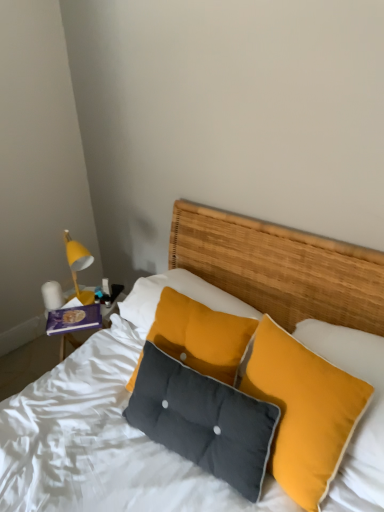
The width and height of the screenshot is (384, 512). What do you see at coordinates (78, 265) in the screenshot?
I see `yellow matte lampshade at left` at bounding box center [78, 265].

Image resolution: width=384 pixels, height=512 pixels. In order to click on textured yellow pillow at center, which ranks as the 2th pillow in left-to-right order in this screenshot , I will do `click(304, 411)`.

What do you see at coordinates (100, 443) in the screenshot? This screenshot has height=512, width=384. I see `textured woven headboard at center` at bounding box center [100, 443].

Find the location of a particular element. This screenshot has height=512, width=384. white glossy lamp at left is located at coordinates (52, 295).

The width and height of the screenshot is (384, 512). Find the location of `yellow matte lampshade at left`. yellow matte lampshade at left is located at coordinates (78, 265).

Which object is closer to the camera taking this photo, white glossy lamp at left or dark gray fabric pillow at center, the second pillow when ordered from right to left?

dark gray fabric pillow at center, the second pillow when ordered from right to left.

I want to click on lamp above the dark gray fabric pillow at center, the second pillow when ordered from right to left (from the image's perspective), so click(x=52, y=295).

Is white glossy lamp at left not near dark gray fabric pillow at center, positioned as the first pillow in left-to-right order?

No, white glossy lamp at left is not far away from dark gray fabric pillow at center, positioned as the first pillow in left-to-right order.

From the image's perspective, does white glossy lamp at left appear higher than dark gray fabric pillow at center, positioned as the first pillow in left-to-right order?

Correct, white glossy lamp at left appears higher than dark gray fabric pillow at center, positioned as the first pillow in left-to-right order, in the image.

From a real-world perspective, is white glossy lamp at left physically below yellow matte lampshade at left?

Correct, in the physical world, white glossy lamp at left is lower than yellow matte lampshade at left.

Does white glossy lamp at left appear on the left side of yellow matte lampshade at left?

Indeed, white glossy lamp at left is positioned on the left side of yellow matte lampshade at left.

Looking at this image, is white glossy lamp at left smaller than yellow matte lampshade at left?

Yes.

Does point (43, 465) lie in front of point (48, 302)?

Yes, point (43, 465) is in front of point (48, 302).

Is textured woven headboard at center positioned with its back to white glossy lamp at left?

No, white glossy lamp at left is not at the back of textured woven headboard at center.

Considering the sizes of objects textured woven headboard at center and white glossy lamp at left in the image provided, who is taller, textured woven headboard at center or white glossy lamp at left?

Standing taller between the two is textured woven headboard at center.

Consider the image. Is textured yellow pillow at center, which ranks as the 2th pillow in left-to-right order, far from dark gray fabric pillow at center, the second pillow when ordered from right to left?

textured yellow pillow at center, which ranks as the 2th pillow in left-to-right order, is near dark gray fabric pillow at center, the second pillow when ordered from right to left, not far away.

Is textured yellow pillow at center, which ranks as the 2th pillow in left-to-right order, wider or thinner than dark gray fabric pillow at center, positioned as the first pillow in left-to-right order?

Considering their sizes, textured yellow pillow at center, which ranks as the 2th pillow in left-to-right order, looks broader than dark gray fabric pillow at center, positioned as the first pillow in left-to-right order.

Between textured yellow pillow at center, which ranks as the 2th pillow in left-to-right order, and dark gray fabric pillow at center, positioned as the first pillow in left-to-right order, which one has less height?

With less height is dark gray fabric pillow at center, positioned as the first pillow in left-to-right order.

Which object is positioned more to the right, textured yellow pillow at center, arranged as the first pillow when viewed from the right, or dark gray fabric pillow at center, positioned as the first pillow in left-to-right order?

textured yellow pillow at center, arranged as the first pillow when viewed from the right.

Considering the sizes of objects white glossy lamp at left and textured woven headboard at center in the image provided, who is wider, white glossy lamp at left or textured woven headboard at center?

textured woven headboard at center is wider.

Considering the sizes of objects white glossy lamp at left and textured woven headboard at center in the image provided, who is shorter, white glossy lamp at left or textured woven headboard at center?

With less height is white glossy lamp at left.

What's the angular difference between white glossy lamp at left and textured woven headboard at center's facing directions?

49.6 degrees separate the facing orientations of white glossy lamp at left and textured woven headboard at center.

Identify the location of lamp behind the textured woven headboard at center. The width and height of the screenshot is (384, 512). (52, 295).

Is yellow matte lampshade at left to the right of textured yellow pillow at center, arranged as the first pillow when viewed from the right, from the viewer's perspective?

No.

Does yellow matte lampshade at left come behind textured yellow pillow at center, which ranks as the 2th pillow in left-to-right order?

Yes, it is.

Is yellow matte lampshade at left turned away from textured yellow pillow at center, which ranks as the 2th pillow in left-to-right order?

No, yellow matte lampshade at left's orientation is not away from textured yellow pillow at center, which ranks as the 2th pillow in left-to-right order.

Between point (92, 298) and point (316, 449), which one is positioned in front?

The point (316, 449) is in front.

Is point (86, 264) closer to camera compared to point (41, 286)?

Yes, it is in front of point (41, 286).

What's the angular difference between yellow matte lampshade at left and white glossy lamp at left's facing directions?

yellow matte lampshade at left and white glossy lamp at left are facing 59.1 degrees away from each other.

From the image's perspective, is yellow matte lampshade at left located above white glossy lamp at left?

Yes.

Which is more to the right, yellow matte lampshade at left or white glossy lamp at left?

Positioned to the right is yellow matte lampshade at left.

Find the location of a particular element. The width and height of the screenshot is (384, 512). pillow that is the 1st one above the white glossy lamp at left (from a real-world perspective) is located at coordinates 203,420.

The width and height of the screenshot is (384, 512). In order to click on lamp below the yellow matte lampshade at left (from the image's perspective) in this screenshot , I will do `click(52, 295)`.

When comparing their distances from textured yellow pillow at center, which ranks as the 2th pillow in left-to-right order, does dark gray fabric pillow at center, positioned as the first pillow in left-to-right order, or white glossy lamp at left seem further?

white glossy lamp at left lies further to textured yellow pillow at center, which ranks as the 2th pillow in left-to-right order, than the other object.

Based on their spatial positions, is textured yellow pillow at center, which ranks as the 2th pillow in left-to-right order, or yellow matte lampshade at left closer to white glossy lamp at left?

Among the two, yellow matte lampshade at left is located nearer to white glossy lamp at left.

When comparing their distances from yellow matte lampshade at left, does textured yellow pillow at center, arranged as the first pillow when viewed from the right, or white glossy lamp at left seem closer?

Among the two, white glossy lamp at left is located nearer to yellow matte lampshade at left.

Considering their positions, is dark gray fabric pillow at center, the second pillow when ordered from right to left, positioned further to textured woven headboard at center than white glossy lamp at left?

white glossy lamp at left is further to textured woven headboard at center.

Based on their spatial positions, is yellow matte lampshade at left or textured yellow pillow at center, which ranks as the 2th pillow in left-to-right order, further from dark gray fabric pillow at center, positioned as the first pillow in left-to-right order?

Among the two, yellow matte lampshade at left is located further to dark gray fabric pillow at center, positioned as the first pillow in left-to-right order.

Consider the image. Considering their positions, is dark gray fabric pillow at center, positioned as the first pillow in left-to-right order, positioned closer to white glossy lamp at left than textured yellow pillow at center, which ranks as the 2th pillow in left-to-right order?

dark gray fabric pillow at center, positioned as the first pillow in left-to-right order.

Looking at the image, which one is located closer to textured woven headboard at center, yellow matte lampshade at left or textured yellow pillow at center, arranged as the first pillow when viewed from the right?

textured yellow pillow at center, arranged as the first pillow when viewed from the right, is positioned closer to the anchor textured woven headboard at center.

When comparing their distances from white glossy lamp at left, does yellow matte lampshade at left or textured yellow pillow at center, which ranks as the 2th pillow in left-to-right order, seem further?

textured yellow pillow at center, which ranks as the 2th pillow in left-to-right order, lies further to white glossy lamp at left than the other object.

Image resolution: width=384 pixels, height=512 pixels. What are the coordinates of `pillow positioned between textured yellow pillow at center, which ranks as the 2th pillow in left-to-right order, and white glossy lamp at left from near to far` in the screenshot? It's located at (203, 420).

You are a GUI agent. You are given a task and a screenshot of the screen. Output one action in this format:
    pyautogui.click(x=<x>, y=<y>)
    Task: Click on the bedside lamp positioned between dark gray fabric pillow at center, positioned as the first pillow in left-to-right order, and white glossy lamp at left from near to far
    This screenshot has width=384, height=512.
    Given the screenshot: What is the action you would take?
    pyautogui.click(x=78, y=265)

You are a GUI agent. You are given a task and a screenshot of the screen. Output one action in this format:
    pyautogui.click(x=<x>, y=<y>)
    Task: Click on the bedside lamp between textured woven headboard at center and white glossy lamp at left from front to back
    The image size is (384, 512).
    Given the screenshot: What is the action you would take?
    pyautogui.click(x=78, y=265)

In order to click on bed between textured yellow pillow at center, which ranks as the 2th pillow in left-to-right order, and yellow matte lampshade at left, along the z-axis in this screenshot , I will do `click(100, 443)`.